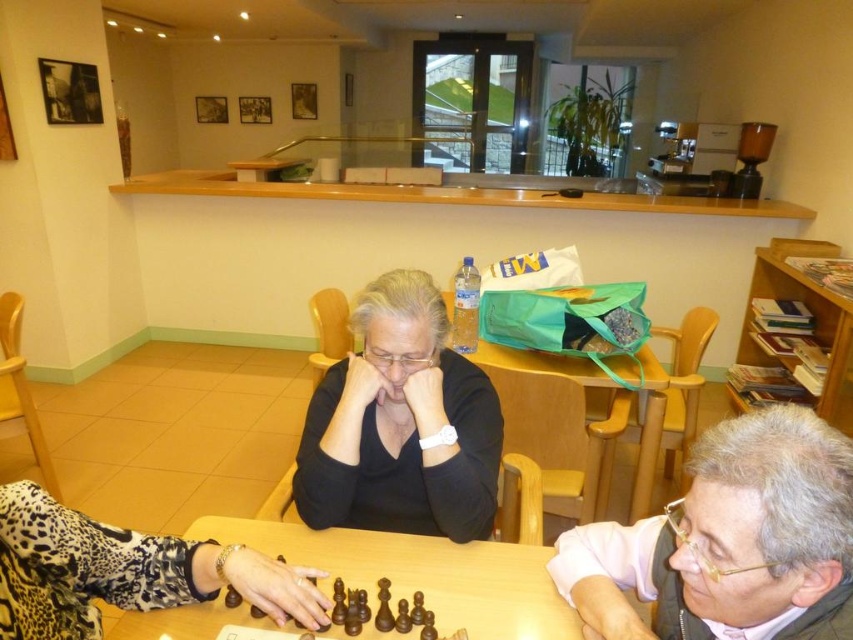
Measure the distance between point (444, 456) and camera.

The distance of point (444, 456) from camera is 1.34 meters.

Can you confirm if black matte sweater at center is smaller than wooden at center?

Actually, black matte sweater at center might be larger than wooden at center.

Does point (350, 355) come farther from viewer compared to point (454, 566)?

Yes, it is.

Identify the location of black matte sweater at center. (401, 426).

Does point (813, 524) lie behind point (469, 524)?

No, (813, 524) is closer to viewer.

Between point (677, 540) and point (372, 493), which one is positioned behind?

The point (372, 493) is more distant.

Does point (795, 480) lie behind point (451, 525)?

That is False.

At what (x,y) coordinates should I click in order to perform the action: click on gray hair at upper right. Please return your answer as a coordinate pair (x, y). This screenshot has width=853, height=640. Looking at the image, I should click on coord(729,541).

Does black matte sweater at center appear over green fabric bag at center?

Correct, black matte sweater at center is located above green fabric bag at center.

Locate an element on the screen. black matte sweater at center is located at coordinates (401, 426).